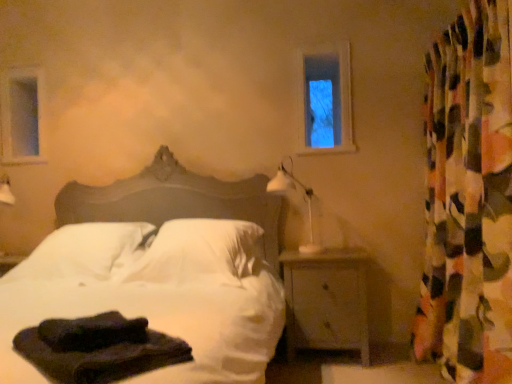
The image size is (512, 384). Find the location of `vacant space situated above wooden nightstand at lower right (from a real-world perspective)`. vacant space situated above wooden nightstand at lower right (from a real-world perspective) is located at coordinates (325, 251).